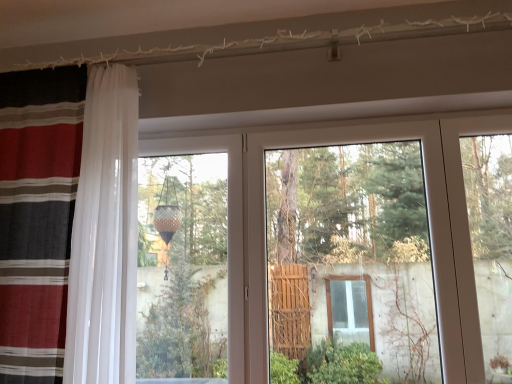
Question: Is striped fabric curtain at left not close to transparent glass door at center?

Choices:
 (A) no
 (B) yes

Answer: (B)

Question: Is striped fabric curtain at left completely or partially outside of transparent glass door at center?

Choices:
 (A) yes
 (B) no

Answer: (A)

Question: From a real-world perspective, does striped fabric curtain at left sit lower than transparent glass door at center?

Choices:
 (A) yes
 (B) no

Answer: (B)

Question: Is striped fabric curtain at left closer to camera compared to transparent glass door at center?

Choices:
 (A) no
 (B) yes

Answer: (B)

Question: Considering the relative sizes of striped fabric curtain at left and transparent glass door at center in the image provided, is striped fabric curtain at left taller than transparent glass door at center?

Choices:
 (A) yes
 (B) no

Answer: (A)

Question: From a real-world perspective, is striped fabric curtain at left physically above transparent glass door at center?

Choices:
 (A) yes
 (B) no

Answer: (A)

Question: Is transparent glass door at center not near striped fabric curtain at left?

Choices:
 (A) no
 (B) yes

Answer: (B)

Question: From a real-world perspective, is transparent glass door at center beneath striped fabric curtain at left?

Choices:
 (A) yes
 (B) no

Answer: (A)

Question: Is transparent glass door at center facing towards striped fabric curtain at left?

Choices:
 (A) yes
 (B) no

Answer: (B)

Question: Considering the relative sizes of transparent glass door at center and striped fabric curtain at left in the image provided, is transparent glass door at center wider than striped fabric curtain at left?

Choices:
 (A) yes
 (B) no

Answer: (B)

Question: From a real-world perspective, is transparent glass door at center physically above striped fabric curtain at left?

Choices:
 (A) no
 (B) yes

Answer: (A)

Question: Considering the relative sizes of transparent glass door at center and striped fabric curtain at left in the image provided, is transparent glass door at center thinner than striped fabric curtain at left?

Choices:
 (A) yes
 (B) no

Answer: (A)

Question: In terms of size, does striped fabric curtain at left appear bigger or smaller than transparent glass door at center?

Choices:
 (A) small
 (B) big

Answer: (B)